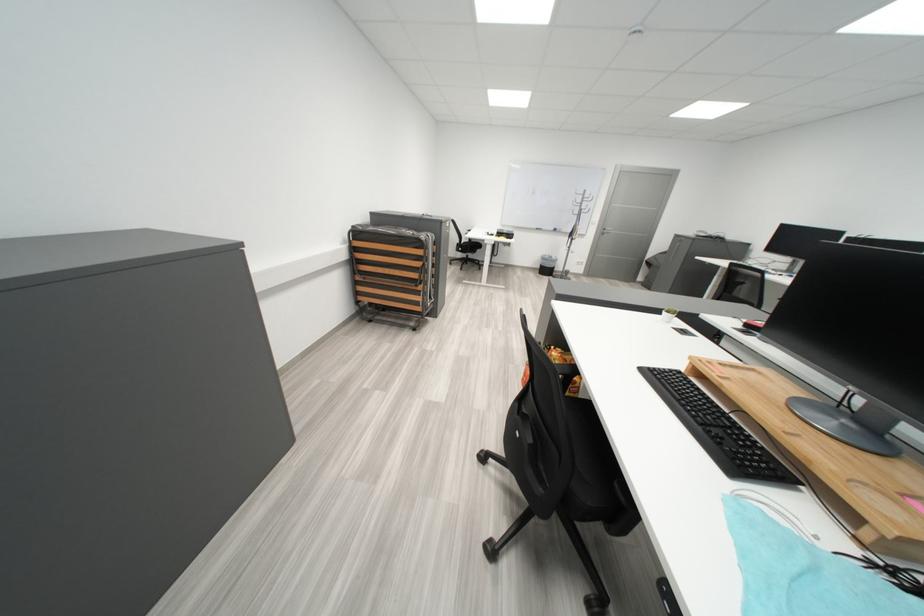
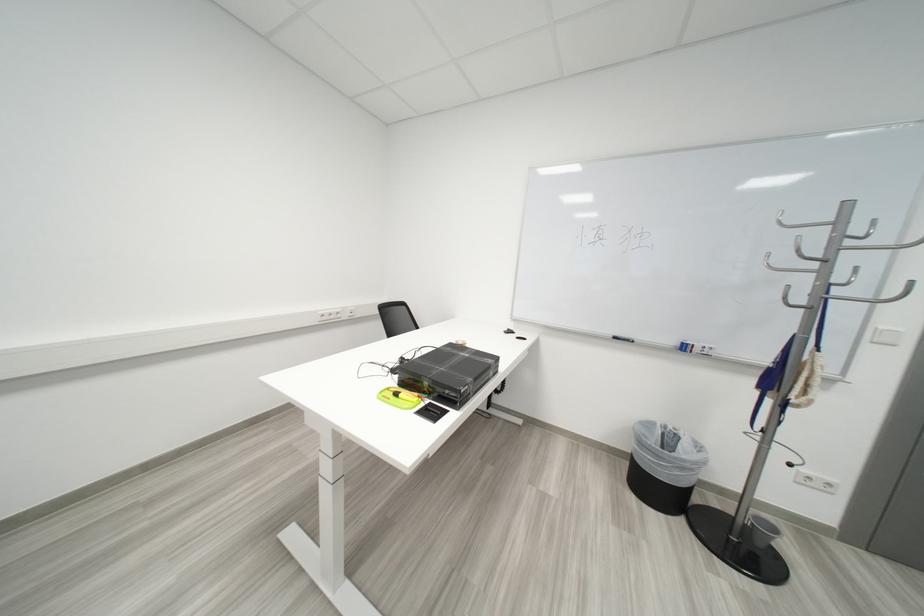
Find the pixel in the second image that matches the point at 597,200 in the first image.

(853, 238)